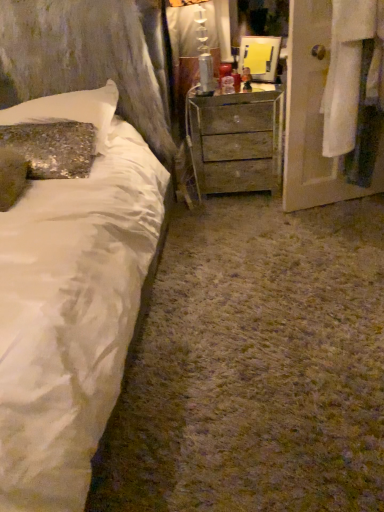
Question: Should I look upward or downward to see white satin bed at left?

Choices:
 (A) down
 (B) up

Answer: (B)

Question: From a real-world perspective, is wooden chest of drawers at center positioned under sparkly sequin pillow at upper left based on gravity?

Choices:
 (A) no
 (B) yes

Answer: (B)

Question: Is wooden chest of drawers at center thinner than sparkly sequin pillow at upper left?

Choices:
 (A) yes
 (B) no

Answer: (A)

Question: Is wooden chest of drawers at center placed right next to sparkly sequin pillow at upper left?

Choices:
 (A) yes
 (B) no

Answer: (B)

Question: Is wooden chest of drawers at center aimed at sparkly sequin pillow at upper left?

Choices:
 (A) no
 (B) yes

Answer: (A)

Question: Is wooden chest of drawers at center facing away from sparkly sequin pillow at upper left?

Choices:
 (A) no
 (B) yes

Answer: (A)

Question: Is wooden chest of drawers at center outside sparkly sequin pillow at upper left?

Choices:
 (A) yes
 (B) no

Answer: (A)

Question: Is sparkly sequin pillow at upper left wider than white satin bed at left?

Choices:
 (A) yes
 (B) no

Answer: (B)

Question: Considering the relative sizes of sparkly sequin pillow at upper left and white satin bed at left in the image provided, is sparkly sequin pillow at upper left shorter than white satin bed at left?

Choices:
 (A) no
 (B) yes

Answer: (B)

Question: Is sparkly sequin pillow at upper left aimed at white satin bed at left?

Choices:
 (A) no
 (B) yes

Answer: (B)

Question: Is sparkly sequin pillow at upper left next to white satin bed at left?

Choices:
 (A) yes
 (B) no

Answer: (B)

Question: Is sparkly sequin pillow at upper left positioned beyond the bounds of white satin bed at left?

Choices:
 (A) yes
 (B) no

Answer: (B)

Question: Considering the relative sizes of sparkly sequin pillow at upper left and white satin bed at left in the image provided, is sparkly sequin pillow at upper left taller than white satin bed at left?

Choices:
 (A) no
 (B) yes

Answer: (A)

Question: Considering the relative positions of white fabric door at right and white satin bed at left in the image provided, is white fabric door at right to the right of white satin bed at left from the viewer's perspective?

Choices:
 (A) yes
 (B) no

Answer: (A)